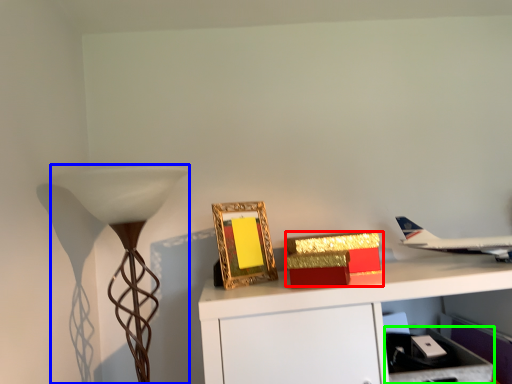
Question: Which is farther away from box (highlighted by a red box)? lamp (highlighted by a blue box) or drawer (highlighted by a green box)?

Choices:
 (A) lamp
 (B) drawer

Answer: (A)